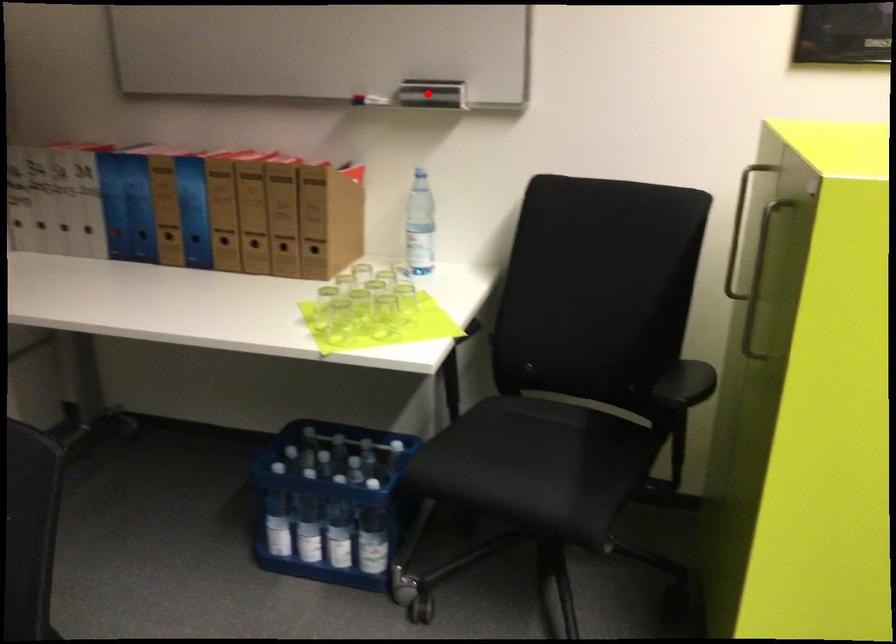
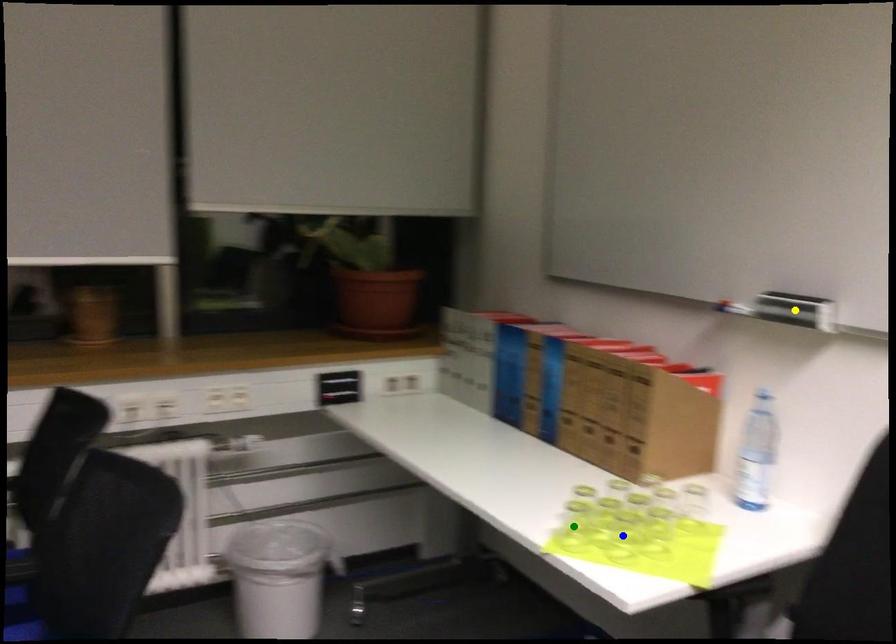
Question: I am providing you with two images of the same scene from different viewpoints. A red point is marked on the first image. You are given multiple points on the second image. Which point in image 2 represents the same 3d spot as the red point in image 1?

Choices:
 (A) green point
 (B) blue point
 (C) yellow point

Answer: (C)